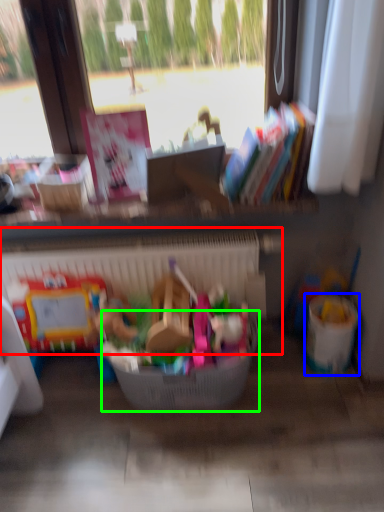
Question: Considering the real-world distances, which object is farthest from radiator (highlighted by a red box)? recycling bin (highlighted by a blue box) or basket (highlighted by a green box)?

Choices:
 (A) recycling bin
 (B) basket

Answer: (A)